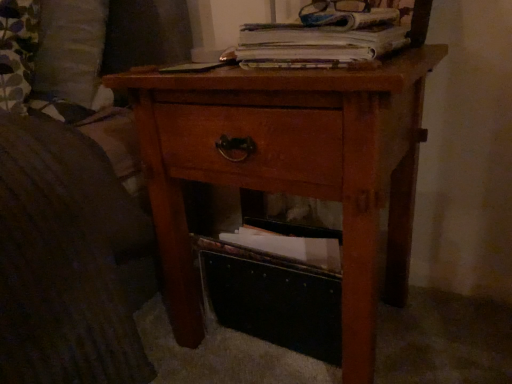
Question: Can you confirm if white paper at upper center is thinner than black fabric storage box at lower center?

Choices:
 (A) no
 (B) yes

Answer: (A)

Question: Is white paper at upper center looking in the opposite direction of black fabric storage box at lower center?

Choices:
 (A) no
 (B) yes

Answer: (A)

Question: Is white paper at upper center wider than black fabric storage box at lower center?

Choices:
 (A) no
 (B) yes

Answer: (B)

Question: From a real-world perspective, is white paper at upper center located beneath black fabric storage box at lower center?

Choices:
 (A) no
 (B) yes

Answer: (A)

Question: Can you confirm if white paper at upper center is smaller than black fabric storage box at lower center?

Choices:
 (A) no
 (B) yes

Answer: (B)

Question: Considering the relative positions of black fabric storage box at lower center and wooden nightstand at center in the image provided, is black fabric storage box at lower center to the left or to the right of wooden nightstand at center?

Choices:
 (A) right
 (B) left

Answer: (A)

Question: In terms of height, does black fabric storage box at lower center look taller or shorter compared to wooden nightstand at center?

Choices:
 (A) short
 (B) tall

Answer: (A)

Question: Looking at their shapes, would you say black fabric storage box at lower center is wider or thinner than wooden nightstand at center?

Choices:
 (A) thin
 (B) wide

Answer: (A)

Question: Choose the correct answer: Is black fabric storage box at lower center inside wooden nightstand at center or outside it?

Choices:
 (A) outside
 (B) inside

Answer: (B)

Question: Based on their sizes in the image, would you say black fabric storage box at lower center is bigger or smaller than white paper at upper center?

Choices:
 (A) small
 (B) big

Answer: (B)

Question: From a real-world perspective, is black fabric storage box at lower center above or below white paper at upper center?

Choices:
 (A) below
 (B) above

Answer: (A)

Question: Is black fabric storage box at lower center inside the boundaries of white paper at upper center, or outside?

Choices:
 (A) inside
 (B) outside

Answer: (B)

Question: Considering their positions, is black fabric storage box at lower center located in front of or behind white paper at upper center?

Choices:
 (A) behind
 (B) front

Answer: (A)

Question: Looking at the image, does white paper at upper center seem bigger or smaller compared to black fabric storage box at lower center?

Choices:
 (A) big
 (B) small

Answer: (B)

Question: Does point (393, 31) appear closer or farther from the camera than point (262, 254)?

Choices:
 (A) closer
 (B) farther

Answer: (A)